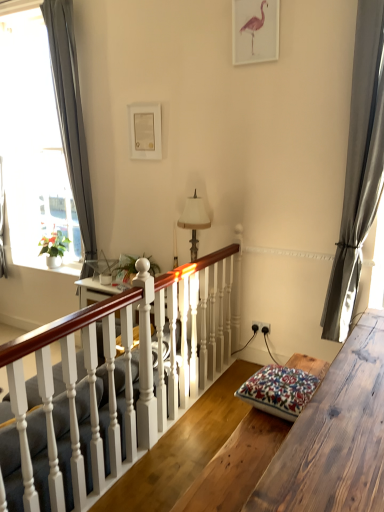
Question: From the image's perspective, is matte pink flamingo at upper center, which is the 2th picture frame from back to front, located above or below floral-patterned fabric cushion at lower right?

Choices:
 (A) below
 (B) above

Answer: (B)

Question: Is matte pink flamingo at upper center, the 1th picture frame in the top-to-bottom sequence, wider or thinner than floral-patterned fabric cushion at lower right?

Choices:
 (A) thin
 (B) wide

Answer: (A)

Question: Estimate the real-world distances between objects in this image. Which object is farther from the white matte picture frame at upper center, the 1th picture frame positioned from the back?

Choices:
 (A) white painted wood stairs at center
 (B) gray fabric curtain at left, which is counted as the 1th curtain, starting from the left
 (C) black plastic power outlet at center-right
 (D) floral-patterned fabric cushion at lower right
 (E) white painted wood at center

Answer: (D)

Question: Which object is positioned closest to the white matte picture frame at upper center, the 1th picture frame positioned from the back?

Choices:
 (A) satin gray curtain at right, which is counted as the first curtain, starting from the front
 (B) matte pink flamingo at upper center, the 1th picture frame in the top-to-bottom sequence
 (C) white painted wood stairs at center
 (D) floral-patterned fabric cushion at lower right
 (E) white painted wood at center

Answer: (B)